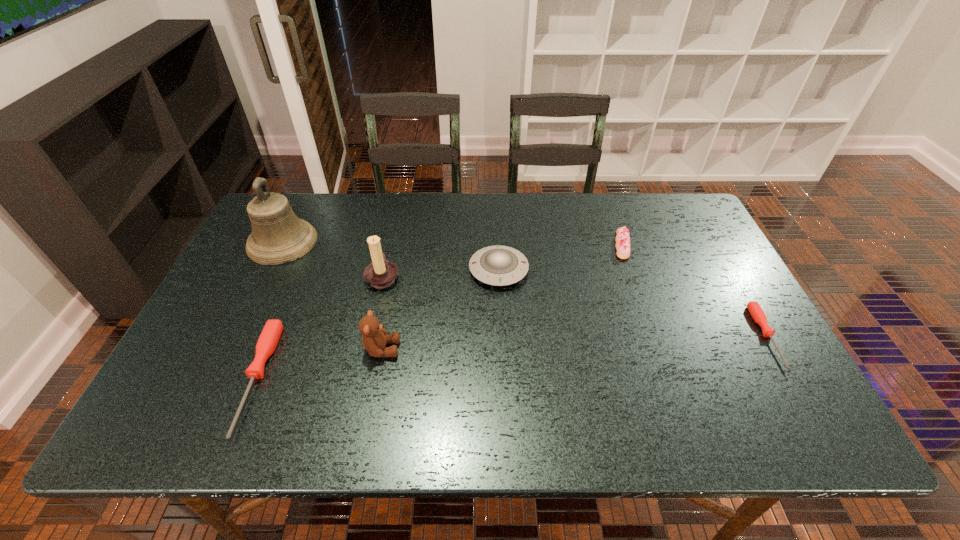
Identify the location of free space that satisfies the following two spatial constraints: 1. on the front side of the eclair; 2. on the face of the teddy bear. (659, 349).